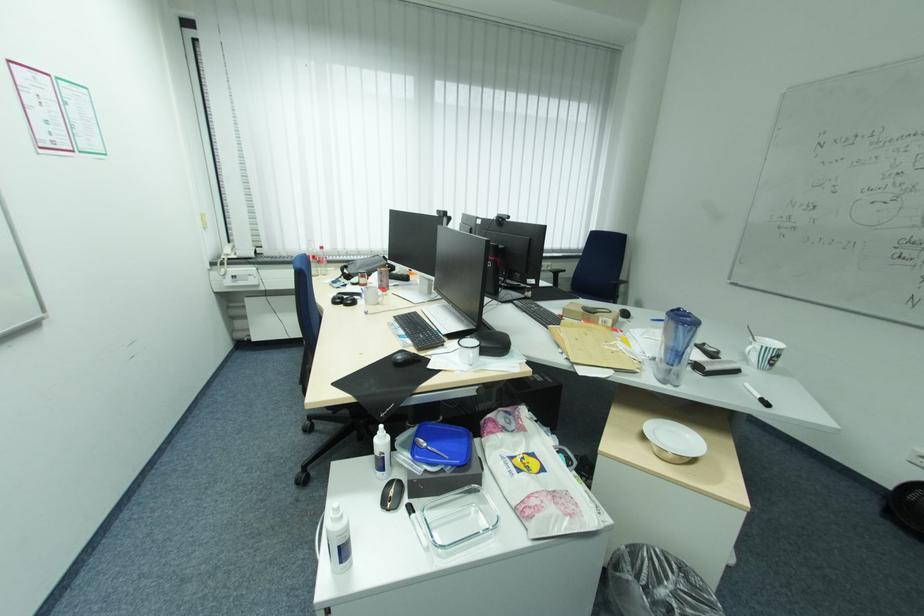
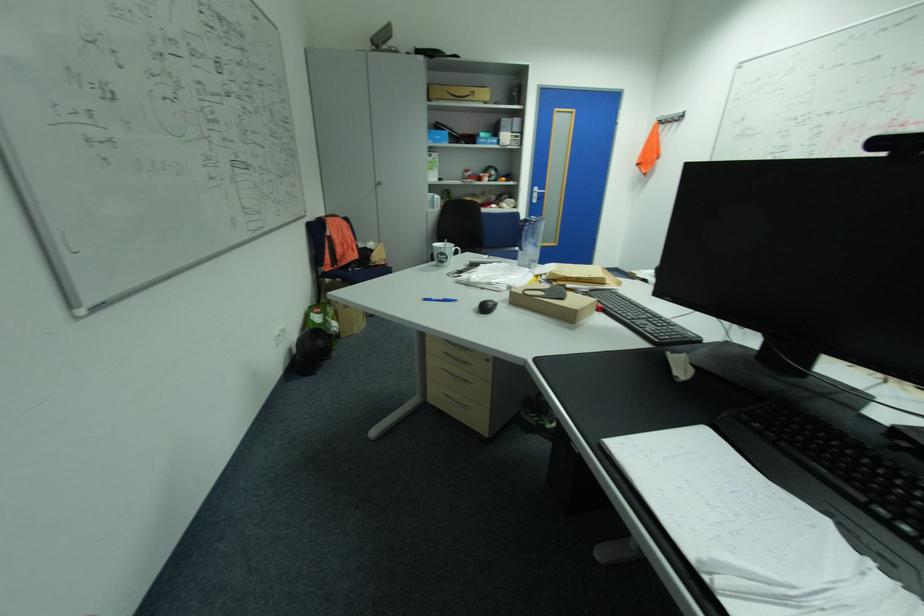
Question: I am providing you with two images of the same scene from different viewpoints. Which of the following objects are not visible in image2?

Choices:
 (A) blue pen
 (B) key in lock
 (C) black keyboard
 (D) silver door handle

Answer: (C)